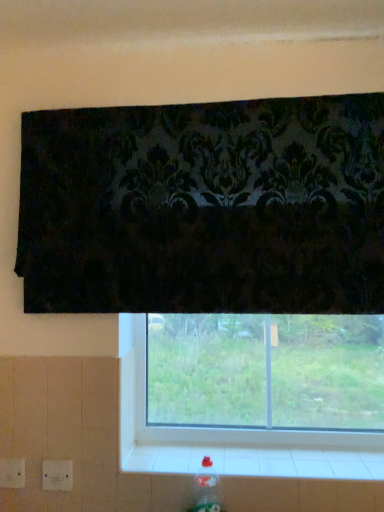
What do you see at coordinates (207, 488) in the screenshot?
I see `clear plastic bottle at lower right` at bounding box center [207, 488].

You are a GUI agent. You are given a task and a screenshot of the screen. Output one action in this format:
    pyautogui.click(x=<x>, y=<y>)
    Task: Click on the white tile at lower center
    
    Given the screenshot: What is the action you would take?
    pyautogui.click(x=257, y=461)

What are the coordinates of `transparent glass window at center` in the screenshot? It's located at (226, 428).

Looking at the image, does transparent glass window at center seem bigger or smaller compared to clear plastic bottle at lower right?

Considering their sizes, transparent glass window at center takes up more space than clear plastic bottle at lower right.

Is transparent glass window at center taller or shorter than clear plastic bottle at lower right?

Considering their sizes, transparent glass window at center has more height than clear plastic bottle at lower right.

Does transparent glass window at center appear on the right side of clear plastic bottle at lower right?

Yes.

How distant is transparent glass window at center from clear plastic bottle at lower right?

transparent glass window at center is 10.42 inches from clear plastic bottle at lower right.

Considering the relative sizes of clear plastic bottle at lower right and transparent glass window at center in the image provided, is clear plastic bottle at lower right smaller than transparent glass window at center?

Yes.

Is clear plastic bottle at lower right taller or shorter than transparent glass window at center?

In the image, clear plastic bottle at lower right appears to be shorter than transparent glass window at center.

Do you think clear plastic bottle at lower right is within transparent glass window at center, or outside of it?

clear plastic bottle at lower right is outside transparent glass window at center.

What's the angular difference between clear plastic bottle at lower right and transparent glass window at center's facing directions?

0.666 degrees.

Is white tile at lower center aimed at clear plastic bottle at lower right?

No.

I want to click on window sill that appears above the clear plastic bottle at lower right (from a real-world perspective), so click(257, 461).

Is white tile at lower center next to clear plastic bottle at lower right and touching it?

white tile at lower center is not next to clear plastic bottle at lower right, and they're not touching.

Who is shorter, white tile at lower center or clear plastic bottle at lower right?

Standing shorter between the two is white tile at lower center.

Considering the sizes of transparent glass window at center and white tile at lower center in the image, is transparent glass window at center taller or shorter than white tile at lower center?

In the image, transparent glass window at center appears to be taller than white tile at lower center.

Looking at this image, which of these two, transparent glass window at center or white tile at lower center, is thinner?

Thinner between the two is transparent glass window at center.

From a real-world perspective, between clear plastic bottle at lower right and white tile at lower center, who is vertically lower?

In real-world perspective, clear plastic bottle at lower right is lower.

Are clear plastic bottle at lower right and white tile at lower center far apart?

clear plastic bottle at lower right is actually quite close to white tile at lower center.

Is clear plastic bottle at lower right positioned beyond the bounds of white tile at lower center?

clear plastic bottle at lower right is positioned outside white tile at lower center.

Considering the positions of objects clear plastic bottle at lower right and white tile at lower center in the image provided, who is more to the left, clear plastic bottle at lower right or white tile at lower center?

clear plastic bottle at lower right is more to the left.

Considering the relative positions of white tile at lower center and transparent glass window at center in the image provided, is white tile at lower center to the left or to the right of transparent glass window at center?

In the image, white tile at lower center appears on the left side of transparent glass window at center.

Based on their sizes in the image, would you say white tile at lower center is bigger or smaller than transparent glass window at center?

white tile at lower center is smaller than transparent glass window at center.

Is white tile at lower center shorter than transparent glass window at center?

Correct, white tile at lower center is not as tall as transparent glass window at center.

You are a GUI agent. You are given a task and a screenshot of the screen. Output one action in this format:
    pyautogui.click(x=<x>, y=<y>)
    Task: Click on the window behind the clear plastic bottle at lower right
    This screenshot has height=512, width=384.
    Given the screenshot: What is the action you would take?
    pyautogui.click(x=226, y=428)

Locate an element on the screen. This screenshot has height=512, width=384. window above the clear plastic bottle at lower right (from the image's perspective) is located at coordinates (226, 428).

Looking at the image, which one is located further to clear plastic bottle at lower right, white tile at lower center or transparent glass window at center?

transparent glass window at center lies further to clear plastic bottle at lower right than the other object.

From the image, which object appears to be nearer to transparent glass window at center, clear plastic bottle at lower right or white tile at lower center?

white tile at lower center.

Looking at this image, looking at the image, which one is located closer to white tile at lower center, clear plastic bottle at lower right or transparent glass window at center?

The object closer to white tile at lower center is transparent glass window at center.

Looking at the image, which one is located further to clear plastic bottle at lower right, transparent glass window at center or white tile at lower center?

Based on the image, transparent glass window at center appears to be further to clear plastic bottle at lower right.

Based on their spatial positions, is white tile at lower center or clear plastic bottle at lower right closer to transparent glass window at center?

A: The object closer to transparent glass window at center is white tile at lower center.

Estimate the real-world distances between objects in this image. Which object is further from white tile at lower center, transparent glass window at center or clear plastic bottle at lower right?

clear plastic bottle at lower right.

The height and width of the screenshot is (512, 384). I want to click on window sill that lies between transparent glass window at center and clear plastic bottle at lower right from top to bottom, so [257, 461].